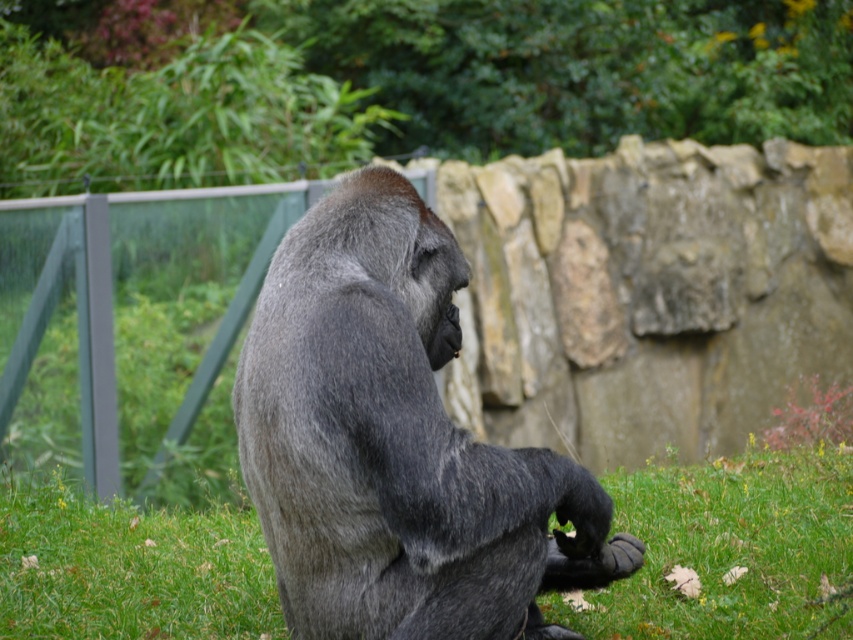
Does gray fur gorilla at center have a larger size compared to green soft grass at center?

Yes, gray fur gorilla at center is bigger than green soft grass at center.

Does point (329, 632) come in front of point (605, 625)?

Yes, point (329, 632) is in front of point (605, 625).

What are the coordinates of `gray fur gorilla at center` in the screenshot? It's located at (396, 444).